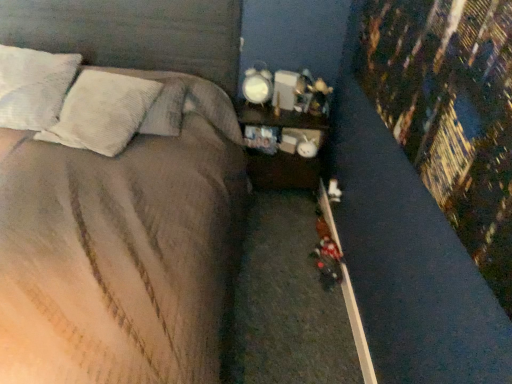
Question: Is wooden nightstand at center in front of or behind white textured pillow at upper left, which is counted as the second pillow, starting from the left, in the image?

Choices:
 (A) behind
 (B) front

Answer: (A)

Question: Is wooden nightstand at center bigger or smaller than white textured pillow at upper left, which is counted as the second pillow, starting from the left?

Choices:
 (A) small
 (B) big

Answer: (B)

Question: Estimate the real-world distances between objects in this image. Which object is farther from the white textured pillow at upper left, the second pillow in the right-to-left sequence?

Choices:
 (A) satin brown bed at center
 (B) wooden nightstand at center
 (C) white glossy alarm clock at upper right
 (D) white textured pillow at upper left, which ranks as the first pillow in right-to-left order
 (E) white textured pillow at upper left, placed as the 3th pillow when sorted from right to left

Answer: (C)

Question: Based on their relative distances, which object is farther from the satin brown bed at center?

Choices:
 (A) white textured pillow at upper left, which is counted as the second pillow, starting from the left
 (B) white textured pillow at upper left, arranged as the 1th pillow when viewed from the left
 (C) white glossy alarm clock at upper right
 (D) white textured pillow at upper left, the 3th pillow viewed from the left
 (E) wooden nightstand at center

Answer: (C)